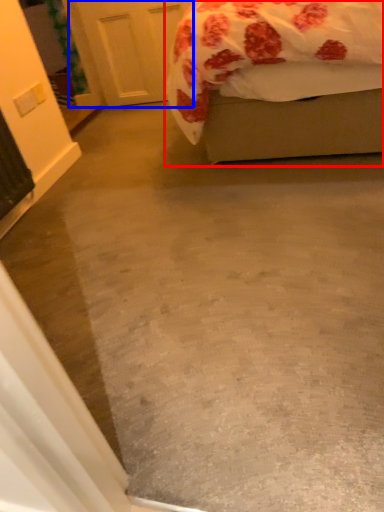
Question: Which object appears closest to the camera in this image, bed (highlighted by a red box) or door (highlighted by a blue box)?

Choices:
 (A) bed
 (B) door

Answer: (A)